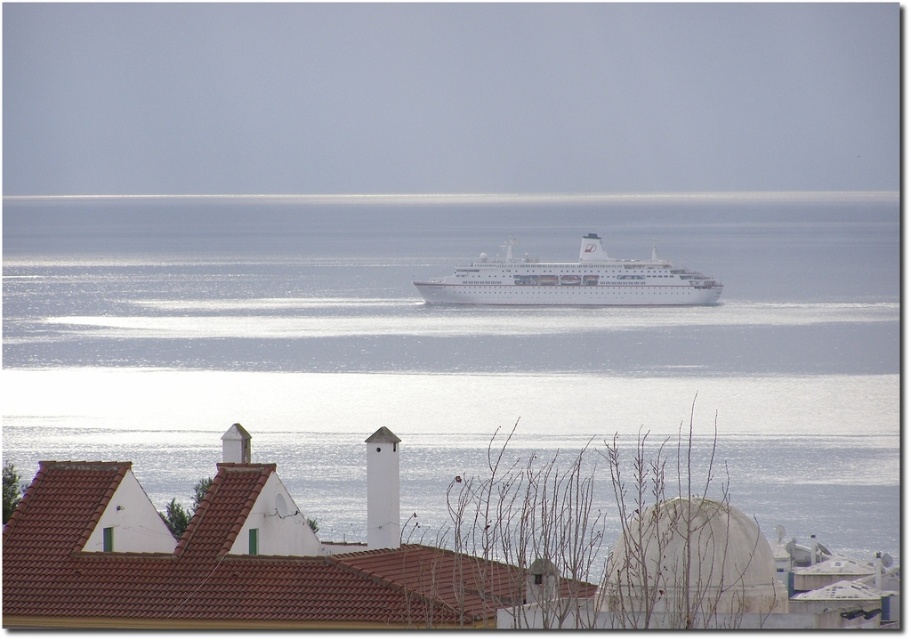
You are standing on the dock and want to know the exact coordinates of the blue water at center. What are its coordinates?

The blue water at center is located at point (453,344).

You are a photographer planning to capture the white glossy cruise ship at center and the blue water at center in a single shot. Based on the scene, which object appears larger in the image?

The blue water at center appears larger because it is much taller than the white glossy cruise ship at center.

You are standing at the coast looking at the cruise ship and the point marked at coordinates (377, 406). If you want to throw a pebble to reach the point, will it be within your throwing distance of 200 meters?

The point marked at coordinates (377, 406) is 257.09 meters away from you, which exceeds your throwing distance of 200 meters. Therefore, you cannot reach it with a single throw.